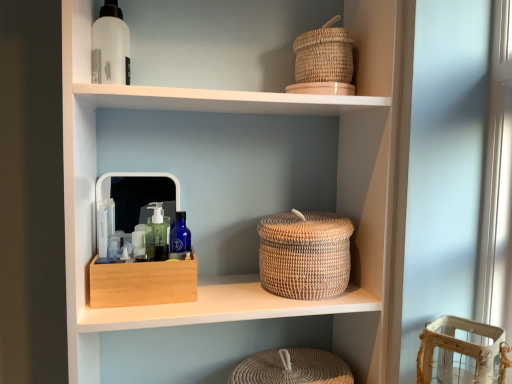
Question: In terms of height, does woven natural basket at upper right, marked as the 1th basket in a top-to-bottom arrangement, look taller or shorter compared to natural woven basket at center?

Choices:
 (A) short
 (B) tall

Answer: (A)

Question: Does point (352, 74) appear closer or farther from the camera than point (347, 294)?

Choices:
 (A) closer
 (B) farther

Answer: (B)

Question: Which of these objects is positioned farthest from the woven natural basket at upper right, marked as the 1th basket in a top-to-bottom arrangement?

Choices:
 (A) beech wood storage box at center
 (B) woven beige basket at lower right, the first basket when ordered from bottom to top
 (C) woven beige basket at center, which is the 2th basket in bottom-to-top order
 (D) natural woven basket at center

Answer: (B)

Question: Which of these objects is positioned closest to the woven beige basket at lower right, the 3th basket viewed from the top?

Choices:
 (A) woven beige basket at center, which is the 2th basket in bottom-to-top order
 (B) beech wood storage box at center
 (C) woven natural basket at upper right, marked as the 1th basket in a top-to-bottom arrangement
 (D) natural woven basket at center

Answer: (A)